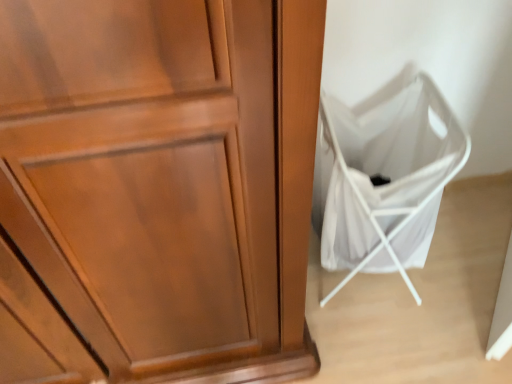
At what (x,y) coordinates should I click in order to perform the action: click on vacant space to the right of white fabric baby carriage at right. Please return your answer as a coordinate pair (x, y). Looking at the image, I should click on point(460,261).